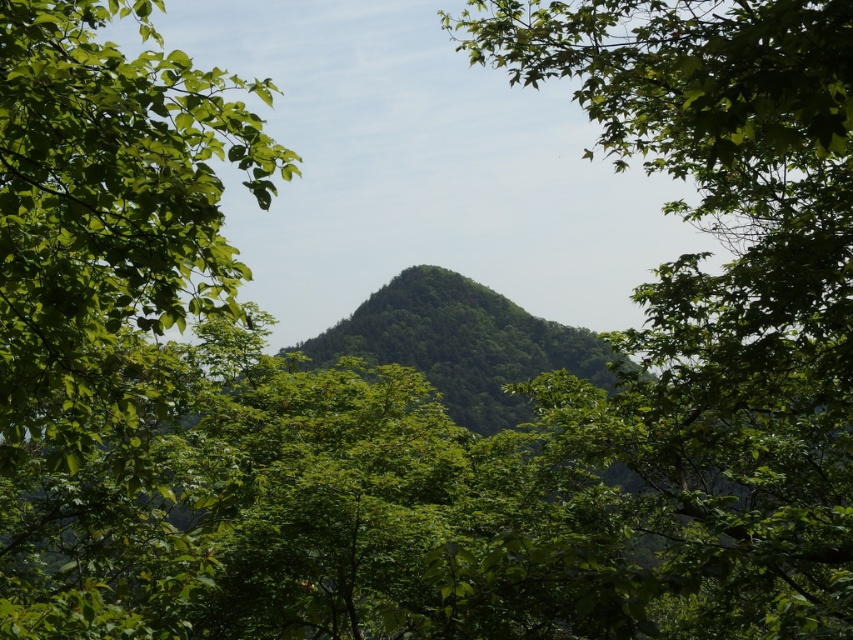
Does green leafy tree at center lie in front of green leafy hillside at center?

Yes, it is in front of green leafy hillside at center.

Based on the photo, who is lower down, green leafy tree at center or green leafy hillside at center?

Positioned lower is green leafy hillside at center.

Is point (802, 48) more distant than point (376, 305)?

That is False.

Where is `green leafy tree at center`? This screenshot has width=853, height=640. green leafy tree at center is located at coordinates (722, 291).